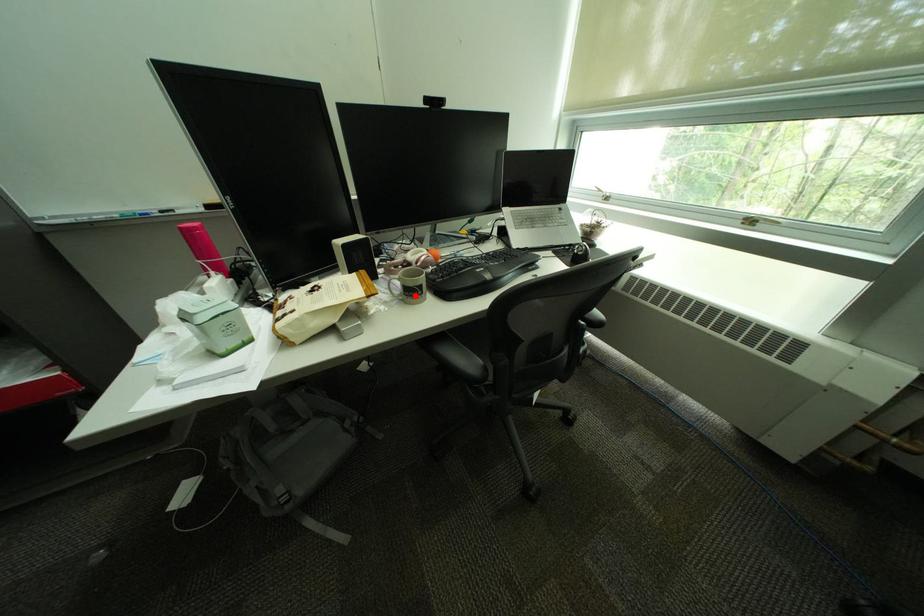
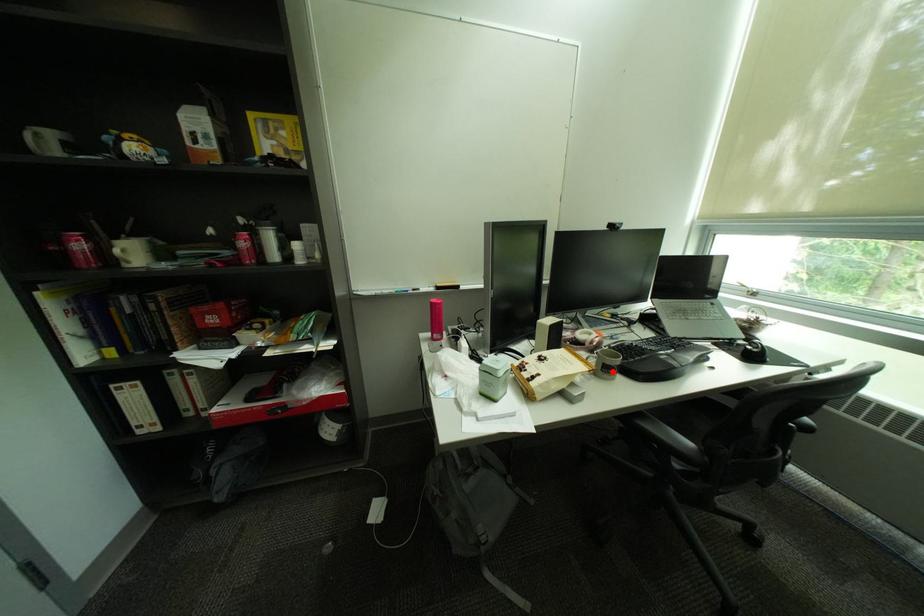
I am providing you with two images of the same scene from different viewpoints. A red point is marked on the first image and another point is marked on the second image. Do the highlighted points in image1 and image2 indicate the same real-world spot?

Yes